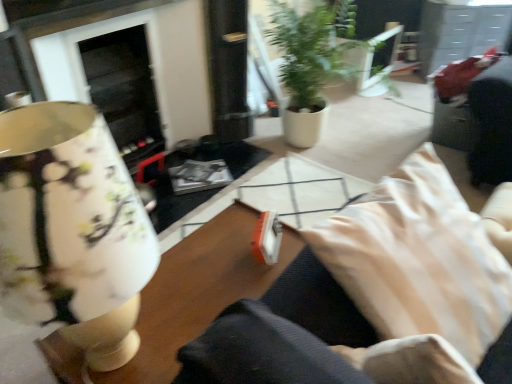
Question: Considering the relative positions of wooden table at center and green matte plant at center in the image provided, is wooden table at center behind green matte plant at center?

Choices:
 (A) no
 (B) yes

Answer: (A)

Question: Does wooden table at center have a larger size compared to green matte plant at center?

Choices:
 (A) no
 (B) yes

Answer: (A)

Question: From the image's perspective, is wooden table at center over green matte plant at center?

Choices:
 (A) no
 (B) yes

Answer: (A)

Question: Considering the relative positions of wooden table at center and green matte plant at center in the image provided, is wooden table at center to the left of green matte plant at center from the viewer's perspective?

Choices:
 (A) no
 (B) yes

Answer: (B)

Question: Does wooden table at center have a smaller size compared to green matte plant at center?

Choices:
 (A) yes
 (B) no

Answer: (A)

Question: Can you confirm if wooden table at center is thinner than green matte plant at center?

Choices:
 (A) no
 (B) yes

Answer: (B)

Question: From the image's perspective, would you say wooden table at center is positioned over matte floral lampshade at left?

Choices:
 (A) yes
 (B) no

Answer: (B)

Question: Would you say wooden table at center is outside matte floral lampshade at left?

Choices:
 (A) yes
 (B) no

Answer: (A)

Question: Is wooden table at center with matte floral lampshade at left?

Choices:
 (A) no
 (B) yes

Answer: (A)

Question: Does wooden table at center lie in front of matte floral lampshade at left?

Choices:
 (A) yes
 (B) no

Answer: (B)

Question: Is matte floral lampshade at left completely or partially inside wooden table at center?

Choices:
 (A) yes
 (B) no

Answer: (B)

Question: Does wooden table at center appear on the left side of matte floral lampshade at left?

Choices:
 (A) no
 (B) yes

Answer: (A)

Question: Is wooden table at center positioned beyond the bounds of beige fabric pillow at lower right?

Choices:
 (A) yes
 (B) no

Answer: (A)